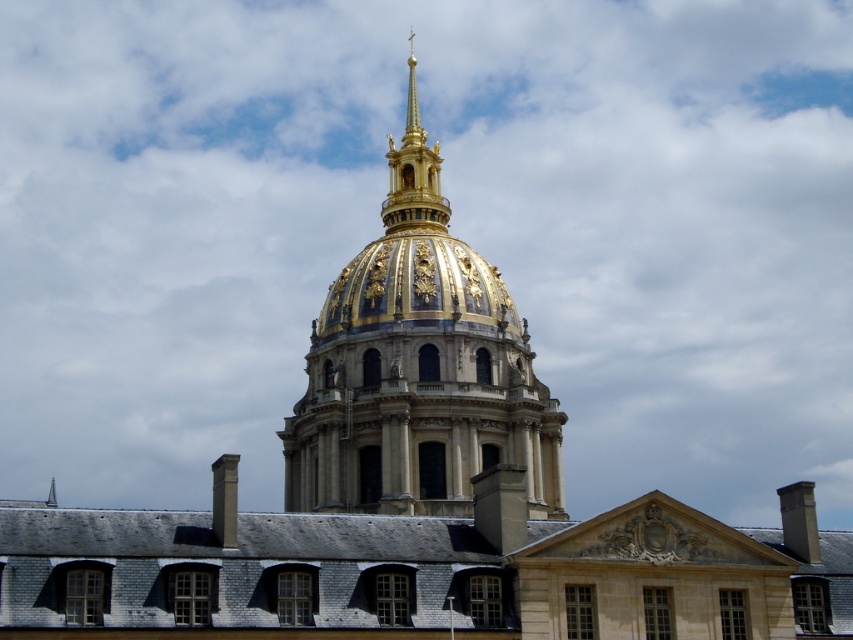
Does gold/gilded dome at center come behind gold/gilded metal spire at upper center?

No, it is in front of gold/gilded metal spire at upper center.

Is gold/gilded dome at center positioned in front of gold/gilded metal spire at upper center?

That is True.

Which is in front, point (399, 208) or point (433, 172)?

Point (399, 208) is in front.

At what (x,y) coordinates should I click in order to perform the action: click on gold/gilded dome at center. Please return your answer as a coordinate pair (x, y). This screenshot has height=640, width=853. Looking at the image, I should click on (418, 368).